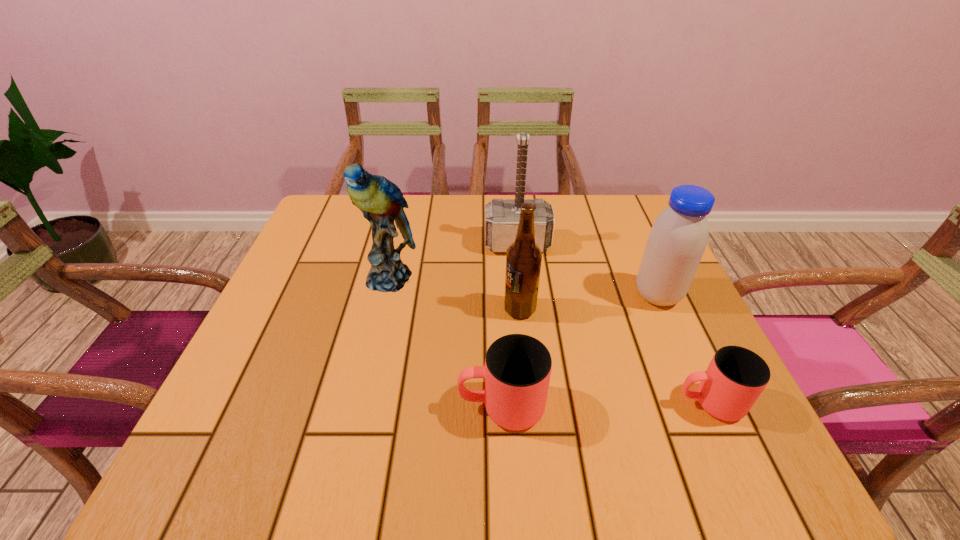
Locate an element on the screen. This screenshot has height=540, width=960. the taller cup is located at coordinates (517, 370).

You are a GUI agent. You are given a task and a screenshot of the screen. Output one action in this format:
    pyautogui.click(x=<x>, y=<y>)
    Task: Click on the second shortest object
    This screenshot has height=540, width=960.
    Given the screenshot: What is the action you would take?
    pyautogui.click(x=517, y=370)

I want to click on the shorter cup, so click(x=736, y=376).

Where is `the right cup`? The image size is (960, 540). the right cup is located at coordinates (736, 376).

Locate an element on the screen. Image resolution: width=960 pixels, height=540 pixels. soya milk is located at coordinates (677, 240).

Where is `parrot`? This screenshot has width=960, height=540. parrot is located at coordinates (381, 201).

You are a GUI agent. You are given a task and a screenshot of the screen. Output one action in this format:
    pyautogui.click(x=<x>, y=<y>)
    Task: Click on the hammer
    The image size is (960, 540).
    Given the screenshot: What is the action you would take?
    pyautogui.click(x=502, y=217)

Identify the location of beer bottle. (523, 257).

Where is `vacant point located on the handle side of the left cup`? This screenshot has height=540, width=960. vacant point located on the handle side of the left cup is located at coordinates (424, 407).

At what (x,y) coordinates should I click in order to perform the action: click on vacant region located 0.270m on the handle side of the left cup. Please return your answer as a coordinate pair (x, y). The height and width of the screenshot is (540, 960). Looking at the image, I should click on (303, 407).